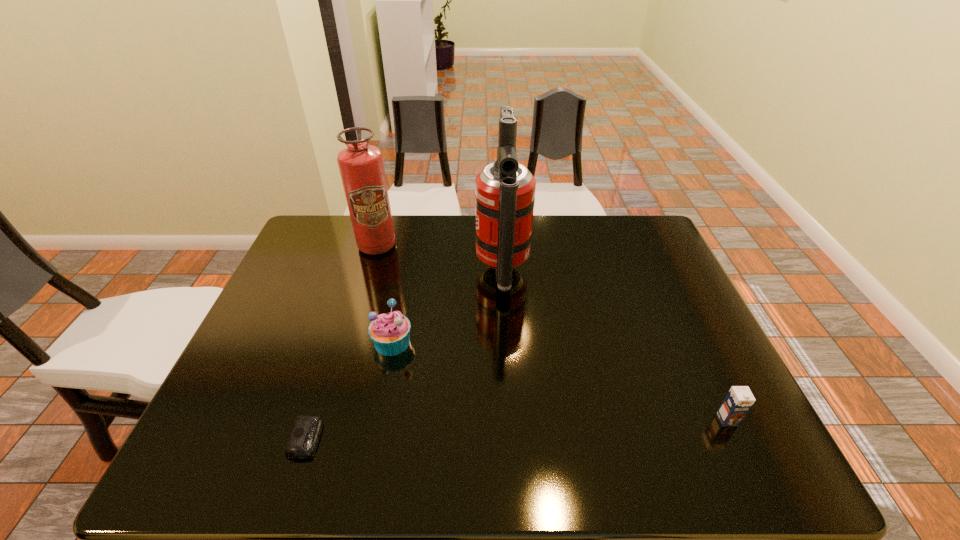
Locate an element on the screen. the taller fire extinguisher is located at coordinates (504, 190).

I want to click on the fourth object from left to right, so click(x=504, y=190).

Where is `the shorter fire extinguisher`? This screenshot has width=960, height=540. the shorter fire extinguisher is located at coordinates (361, 166).

Identify the location of the second tallest object. (361, 166).

Locate an element on the screen. The width and height of the screenshot is (960, 540). muffin is located at coordinates (389, 332).

Image resolution: width=960 pixels, height=540 pixels. What are the coordinates of `chocolate milk` in the screenshot? It's located at (738, 401).

I want to click on the shortest object, so click(x=302, y=443).

Image resolution: width=960 pixels, height=540 pixels. I want to click on vacant space located on the front label side of the taller fire extinguisher, so click(x=442, y=272).

The height and width of the screenshot is (540, 960). Find the location of `vacant space situated 0.110m on the front label side of the taller fire extinguisher`. vacant space situated 0.110m on the front label side of the taller fire extinguisher is located at coordinates (438, 272).

Locate an element on the screen. The image size is (960, 540). free spot located on the front label side of the taller fire extinguisher is located at coordinates (380, 272).